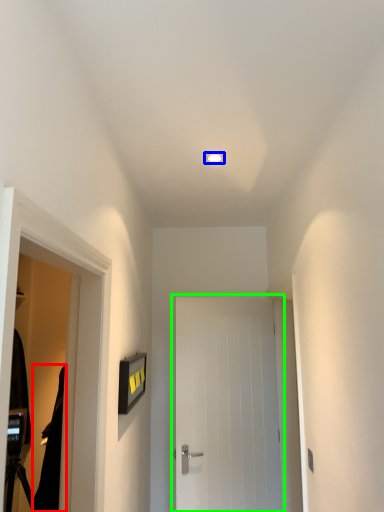
Question: Estimate the real-world distances between objects in this image. Which object is closer to robe (highlighted by a red box), lighting (highlighted by a blue box) or door (highlighted by a green box)?

Choices:
 (A) lighting
 (B) door

Answer: (B)